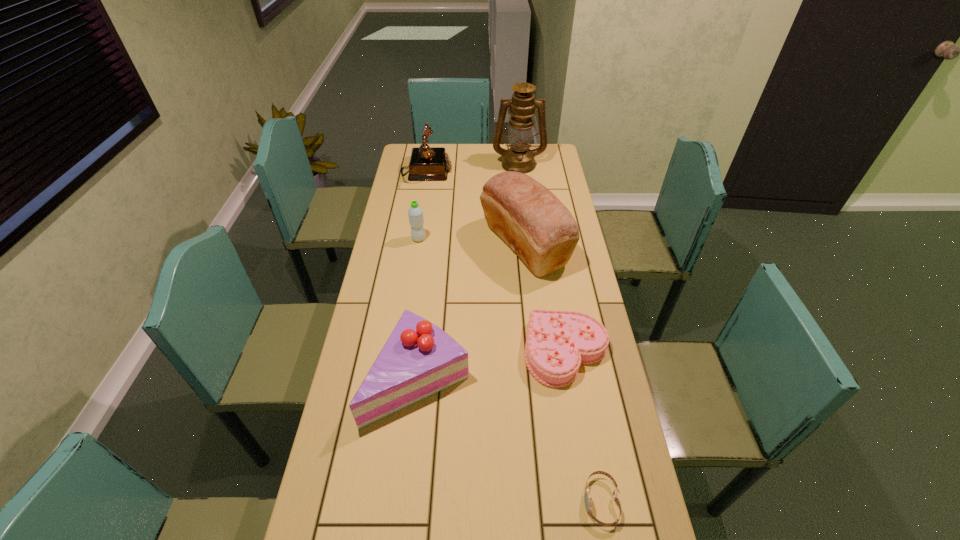
The width and height of the screenshot is (960, 540). In order to click on telephone positioned at the left edge in this screenshot , I will do `click(426, 163)`.

Find the location of `water bottle that is at the left edge`. water bottle that is at the left edge is located at coordinates (415, 212).

The width and height of the screenshot is (960, 540). I want to click on cake present at the left edge, so point(419,359).

At what (x,y) coordinates should I click in order to perform the action: click on oil lamp that is positioned at the right edge. Please return your answer as a coordinate pair (x, y). The width and height of the screenshot is (960, 540). Looking at the image, I should click on coord(519,158).

This screenshot has width=960, height=540. I want to click on bread present at the right edge, so click(x=528, y=217).

What are the coordinates of `cake that is at the right edge` in the screenshot? It's located at (557, 342).

Identify the location of watch located in the right edge section of the desktop. The image size is (960, 540). (587, 496).

Locate an element on the screen. object at the far left corner is located at coordinates (426, 163).

This screenshot has width=960, height=540. Find the location of `object that is at the far right corner`. object that is at the far right corner is located at coordinates (519, 158).

Locate an element on the screen. This screenshot has width=960, height=540. vacant point at the far edge is located at coordinates (469, 148).